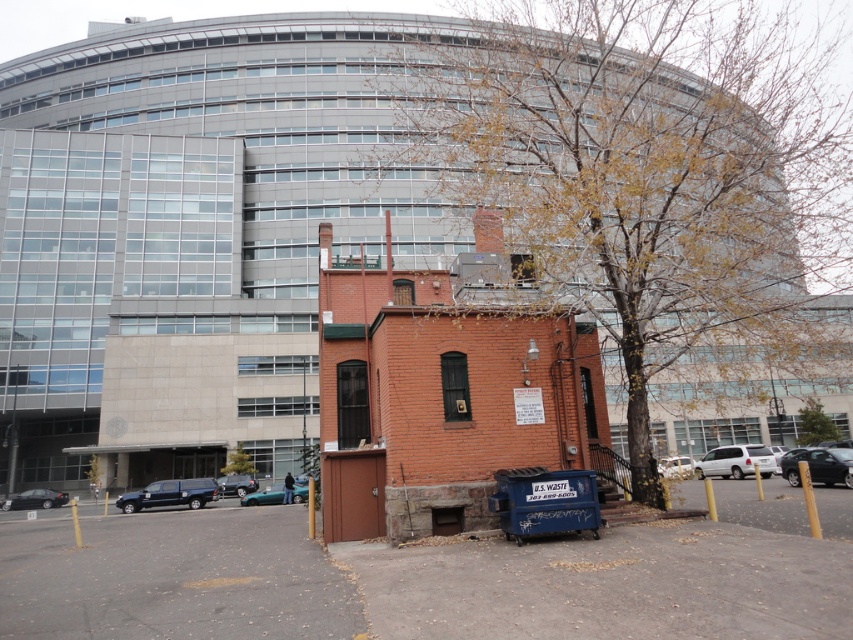
Looking at this image, which of these two, white matte van at center or teal matte car at center, stands taller?

white matte van at center is taller.

Who is more distant from viewer, (755,464) or (299,483)?

The point (299,483) is behind.

You are a GUI agent. You are given a task and a screenshot of the screen. Output one action in this format:
    pyautogui.click(x=<x>, y=<y>)
    Task: Click on the white matte van at center
    The width and height of the screenshot is (853, 640).
    Given the screenshot: What is the action you would take?
    pyautogui.click(x=735, y=461)

Is white matte van at center to the right of black glossy sedan at lower left from the viewer's perspective?

Correct, you'll find white matte van at center to the right of black glossy sedan at lower left.

Between point (711, 454) and point (33, 497), which one is positioned in front?

Positioned in front is point (711, 454).

At what (x,y) coordinates should I click in order to perform the action: click on white matte van at center. Please return your answer as a coordinate pair (x, y). The width and height of the screenshot is (853, 640). Looking at the image, I should click on (735, 461).

Is black glossy sedan at lower left above teal matte car at center?

Actually, black glossy sedan at lower left is below teal matte car at center.

Between black glossy sedan at lower left and teal matte car at center, which one has more height?

With more height is teal matte car at center.

Is point (56, 492) less distant than point (299, 486)?

That is False.

Find the location of a particular element. black glossy sedan at lower left is located at coordinates (35, 499).